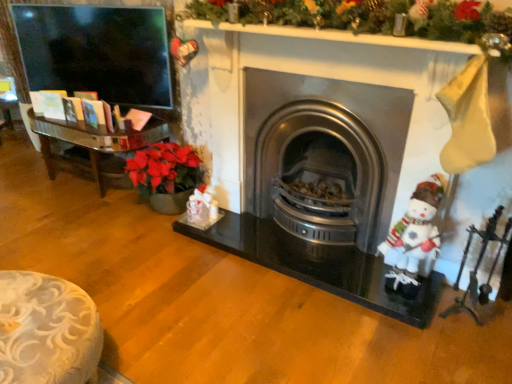
The height and width of the screenshot is (384, 512). Find the location of `vacant space situated on the left part of metallic silver fireplace tools at right`. vacant space situated on the left part of metallic silver fireplace tools at right is located at coordinates (421, 332).